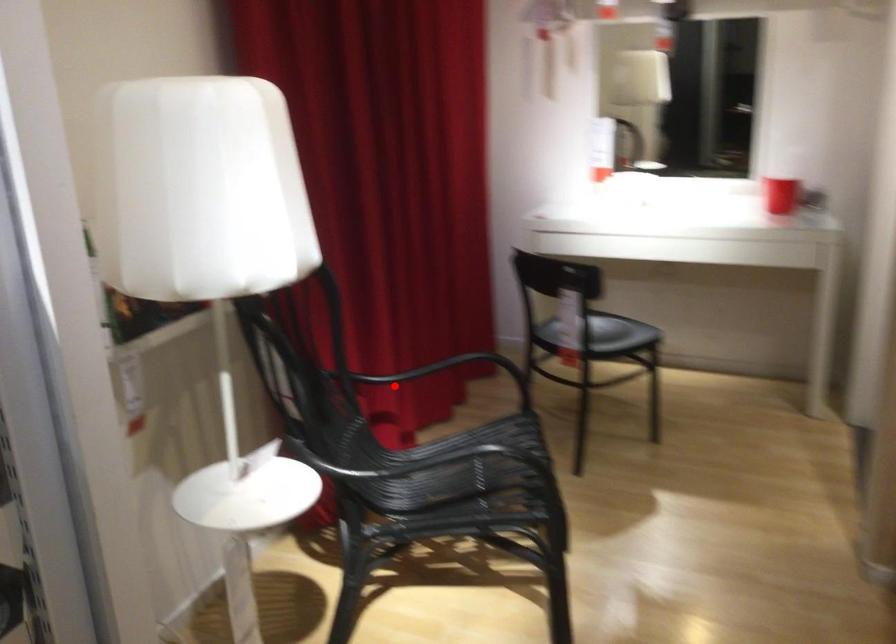
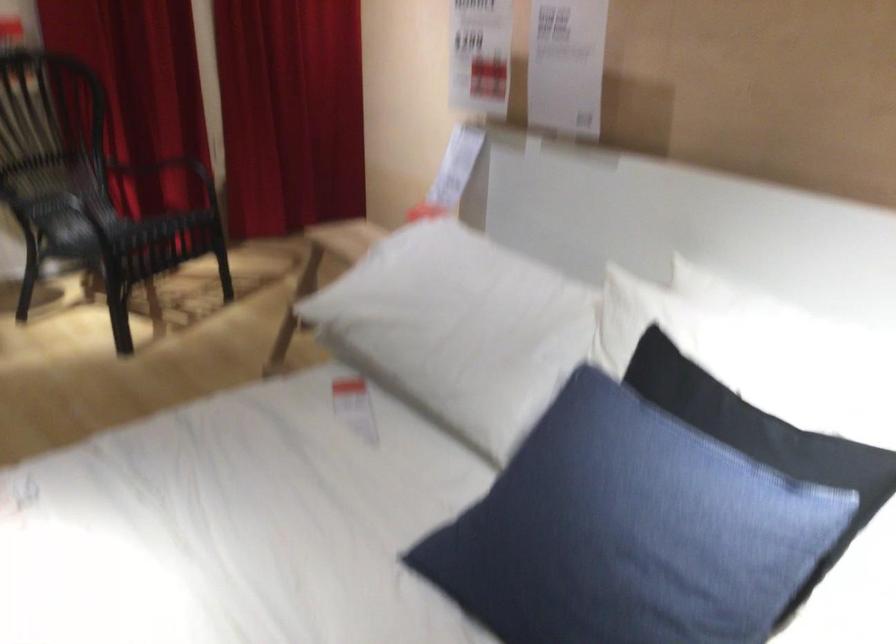
Question: I am providing you with two images of the same scene from different viewpoints. In image1, a red point is highlighted. Considering the same 3D point in image2, which of the following is correct?

Choices:
 (A) It is closer
 (B) It is farther

Answer: (B)